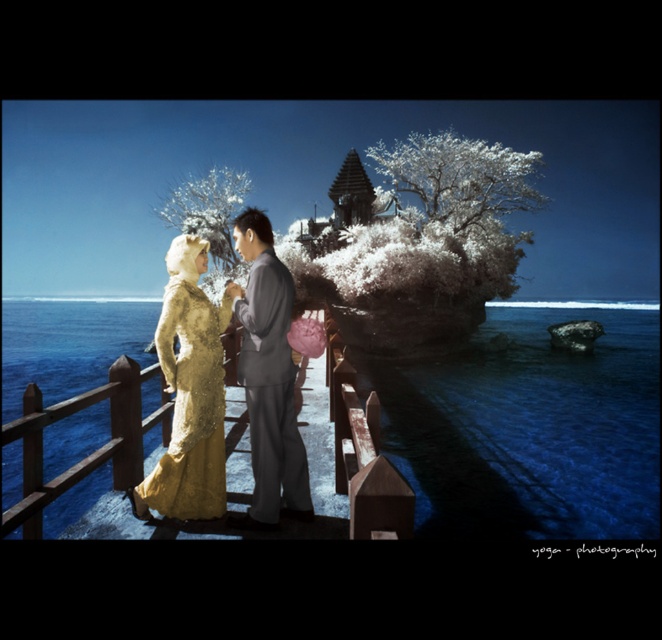
Question: Which of the following is the farthest from the observer?

Choices:
 (A) gold lace dress at center
 (B) blue water at center

Answer: (A)

Question: Does blue water at lower center have a lesser width compared to matte gray suit at center?

Choices:
 (A) no
 (B) yes

Answer: (A)

Question: Can you confirm if blue water at center is wider than matte gray suit at center?

Choices:
 (A) yes
 (B) no

Answer: (A)

Question: Is blue water at lower center smaller than gold lace dress at center?

Choices:
 (A) no
 (B) yes

Answer: (A)

Question: Which point is closer to the camera?

Choices:
 (A) gold lace dress at center
 (B) blue water at lower center
 (C) blue water at center

Answer: (C)

Question: Among these objects, which one is nearest to the camera?

Choices:
 (A) gold sequined gown at center
 (B) blue water at center
 (C) matte gray suit at center
 (D) blue water at lower center

Answer: (B)